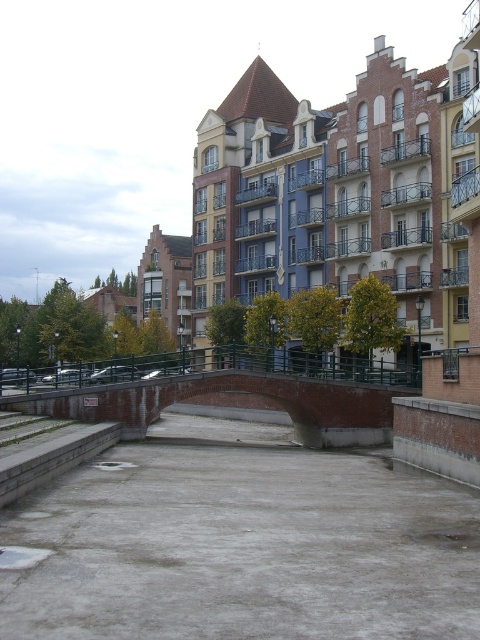
Between gray concrete waterway at center and brick bridge at center, which one is positioned lower?

gray concrete waterway at center is below.

Between point (188, 561) and point (140, 410), which one is positioned behind?

The point (140, 410) is behind.

Is point (7, 572) more distant than point (382, 392)?

No, (7, 572) is in front of (382, 392).

In order to click on gray concrete waterway at center in this screenshot , I will do (242, 544).